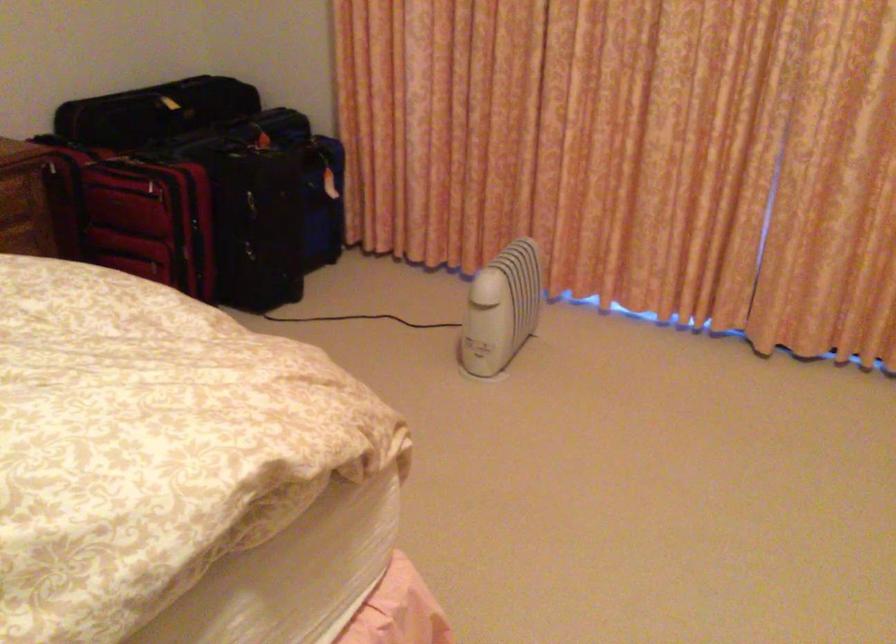
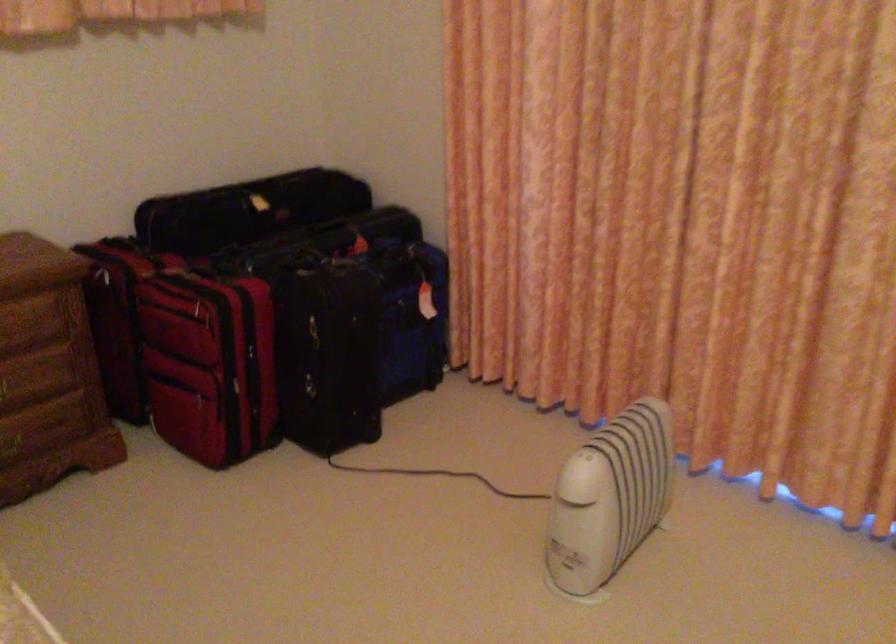
The point at [255,156] is marked in the first image. Where is the corresponding point in the second image?

(330, 266)